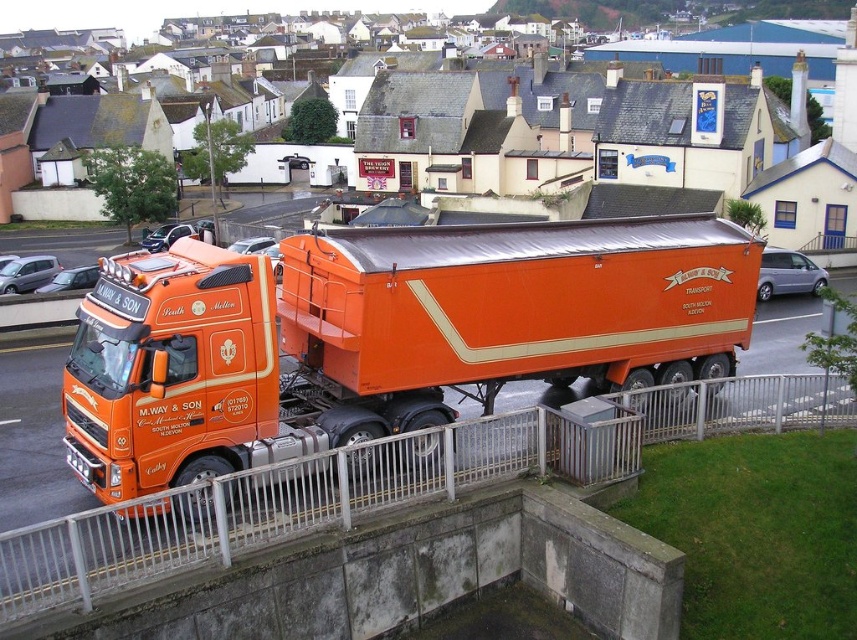
You are a delivery driver who needs to pass under a bridge that has a height restriction of 4 meters. You have an orange matte trailer truck at center and a metallic silver rail at lower center in your path. Which object will you need to consider the height of to ensure safe passage?

The orange matte trailer truck at center has a greater height compared to the metallic silver rail at lower center, so you need to consider the height of the orange matte trailer truck at center to ensure it can safely pass under the bridge.

You are a delivery driver who needs to park your orange matte trailer truck at center in a tight space. There is a metallic silver rail at lower center nearby. Based on their sizes, can you estimate if the truck will fit without hitting the rail?

The orange matte trailer truck at center is bigger than the metallic silver rail at lower center, so the truck may not fit in the tight space without risking a collision with the rail.